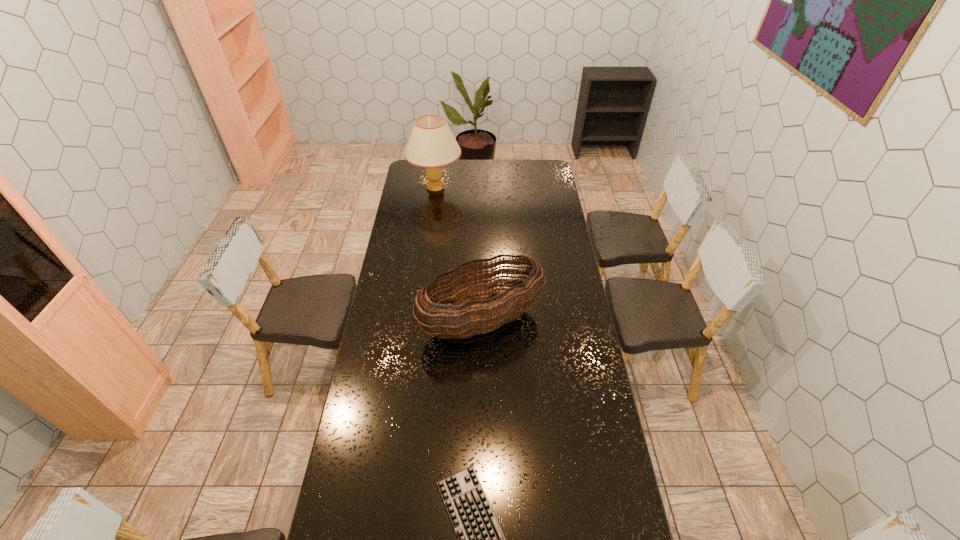
Where is `lampshade`? lampshade is located at coordinates (431, 144).

Where is `the farthest object`? Image resolution: width=960 pixels, height=540 pixels. the farthest object is located at coordinates (431, 144).

The height and width of the screenshot is (540, 960). I want to click on the second tallest object, so coord(477,318).

Identify the location of basket. (477, 318).

Where is `free region located on the front of the lampshade`? The height and width of the screenshot is (540, 960). free region located on the front of the lampshade is located at coordinates (430, 232).

Where is `vacant space located on the back of the second farthest object`? This screenshot has width=960, height=540. vacant space located on the back of the second farthest object is located at coordinates (481, 253).

In order to click on object at the far edge in this screenshot , I will do `click(431, 144)`.

Find the location of a particular element. object positioned at the left edge is located at coordinates (431, 144).

Locate an element on the screen. object that is at the far left corner is located at coordinates (431, 144).

In the image, there is a desktop. Where is `vacant region at the far edge`? The height and width of the screenshot is (540, 960). vacant region at the far edge is located at coordinates (466, 161).